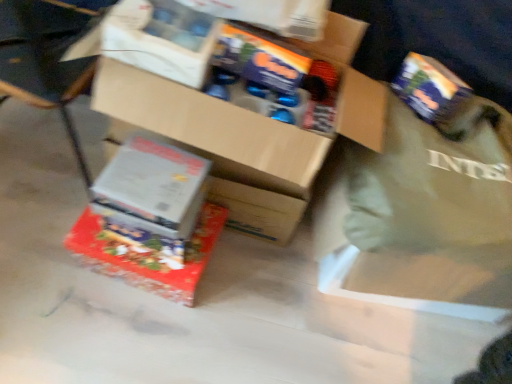
The image size is (512, 384). What are the coordinates of `cardboard box at center, the first box positioned from the top` in the screenshot? It's located at (219, 146).

This screenshot has width=512, height=384. What do you see at coordinates (152, 187) in the screenshot?
I see `white cardboard box at lower left, placed as the 2th box when sorted from bottom to top` at bounding box center [152, 187].

Describe the element at coordinates (433, 181) in the screenshot. I see `green fabric tote bag at right` at that location.

Image resolution: width=512 pixels, height=384 pixels. What are the coordinates of `shiny metallic box at center, placed as the 3th box when sorted from top to bottom` in the screenshot? It's located at (147, 255).

Identify the location of cardboard box at center, marked as the 3th box in a bottom-to-top arrangement. The height and width of the screenshot is (384, 512). [x=219, y=146].

Between cardboard box at center, marked as the 3th box in a bottom-to-top arrangement, and shiny metallic box at center, positioned as the first box in bottom-to-top order, which one is positioned behind?

shiny metallic box at center, positioned as the first box in bottom-to-top order, is more distant.

Can you confirm if cardboard box at center, marked as the 3th box in a bottom-to-top arrangement, is smaller than shiny metallic box at center, positioned as the first box in bottom-to-top order?

Actually, cardboard box at center, marked as the 3th box in a bottom-to-top arrangement, might be larger than shiny metallic box at center, positioned as the first box in bottom-to-top order.

Between point (316, 44) and point (214, 204), which one is positioned behind?

The point (214, 204) is farther from the camera.

What are the coordinates of `the 2nd box below the cardboard box at center, marked as the 3th box in a bottom-to-top arrangement (from a real-world perspective)` in the screenshot? It's located at (147, 255).

Considering the relative positions of cardboard box at center, the first box positioned from the top, and wooden chair at lower left in the image provided, is cardboard box at center, the first box positioned from the top, to the right of wooden chair at lower left from the viewer's perspective?

Yes.

Which object is wider, cardboard box at center, marked as the 3th box in a bottom-to-top arrangement, or wooden chair at lower left?

With larger width is wooden chair at lower left.

Is point (248, 229) positioned in front of point (52, 7)?

No.

Is cardboard box at center, marked as the 3th box in a bottom-to-top arrangement, in front of or behind wooden chair at lower left in the image?

cardboard box at center, marked as the 3th box in a bottom-to-top arrangement, is positioned farther from the viewer than wooden chair at lower left.

From the image's perspective, between wooden chair at lower left and white cardboard box at lower left, placed as the 2th box when sorted from bottom to top, who is located below?

white cardboard box at lower left, placed as the 2th box when sorted from bottom to top, appears lower in the image.

Which is more to the left, wooden chair at lower left or white cardboard box at lower left, placed as the 2th box when sorted from bottom to top?

From the viewer's perspective, wooden chair at lower left appears more on the left side.

Find the location of a particular element. chair that is above the white cardboard box at lower left, placed as the 2th box when sorted from bottom to top (from the image's perspective) is located at coordinates (44, 61).

From a real-world perspective, is wooden chair at lower left under white cardboard box at lower left, marked as the 2th box in a top-to-bottom arrangement?

Correct, in the physical world, wooden chair at lower left is lower than white cardboard box at lower left, marked as the 2th box in a top-to-bottom arrangement.

Is wooden chair at lower left facing away from green fabric tote bag at right?

No.

Is wooden chair at lower left completely or partially outside of green fabric tote bag at right?

Absolutely, wooden chair at lower left is external to green fabric tote bag at right.

Which object is positioned more to the right, wooden chair at lower left or green fabric tote bag at right?

green fabric tote bag at right is more to the right.

From a real-world perspective, which is physically above, wooden chair at lower left or green fabric tote bag at right?

In real-world perspective, green fabric tote bag at right is above.

Considering the relative sizes of green fabric tote bag at right and white cardboard box at lower left, marked as the 2th box in a top-to-bottom arrangement, in the image provided, is green fabric tote bag at right bigger than white cardboard box at lower left, marked as the 2th box in a top-to-bottom arrangement,?

Yes, green fabric tote bag at right is bigger than white cardboard box at lower left, marked as the 2th box in a top-to-bottom arrangement.

Is green fabric tote bag at right positioned beyond the bounds of white cardboard box at lower left, placed as the 2th box when sorted from bottom to top?

Indeed, green fabric tote bag at right is completely outside white cardboard box at lower left, placed as the 2th box when sorted from bottom to top.

From a real-world perspective, is green fabric tote bag at right over white cardboard box at lower left, marked as the 2th box in a top-to-bottom arrangement?

Correct, in the physical world, green fabric tote bag at right is higher than white cardboard box at lower left, marked as the 2th box in a top-to-bottom arrangement.

Is green fabric tote bag at right next to white cardboard box at lower left, marked as the 2th box in a top-to-bottom arrangement, and touching it?

No, green fabric tote bag at right is not making contact with white cardboard box at lower left, marked as the 2th box in a top-to-bottom arrangement.

From the image's perspective, which object appears higher, white cardboard box at lower left, placed as the 2th box when sorted from bottom to top, or green fabric tote bag at right?

white cardboard box at lower left, placed as the 2th box when sorted from bottom to top, from the image's perspective.

Is white cardboard box at lower left, placed as the 2th box when sorted from bottom to top, bigger or smaller than green fabric tote bag at right?

white cardboard box at lower left, placed as the 2th box when sorted from bottom to top, is smaller than green fabric tote bag at right.

Is white cardboard box at lower left, placed as the 2th box when sorted from bottom to top, not near green fabric tote bag at right?

They are positioned close to each other.

Between white cardboard box at lower left, placed as the 2th box when sorted from bottom to top, and green fabric tote bag at right, which one has less height?

Standing shorter between the two is white cardboard box at lower left, placed as the 2th box when sorted from bottom to top.

Considering the sizes of shiny metallic box at center, placed as the 3th box when sorted from top to bottom, and wooden chair at lower left in the image, is shiny metallic box at center, placed as the 3th box when sorted from top to bottom, taller or shorter than wooden chair at lower left?

Clearly, shiny metallic box at center, placed as the 3th box when sorted from top to bottom, is shorter compared to wooden chair at lower left.

Is shiny metallic box at center, placed as the 3th box when sorted from top to bottom, oriented towards wooden chair at lower left?

No, shiny metallic box at center, placed as the 3th box when sorted from top to bottom, is not turned towards wooden chair at lower left.

Between shiny metallic box at center, positioned as the first box in bottom-to-top order, and wooden chair at lower left, which one has larger width?

wooden chair at lower left.

From a real-world perspective, which box is the 2nd one above the shiny metallic box at center, placed as the 3th box when sorted from top to bottom? Please provide its 2D coordinates.

[(219, 146)]

The image size is (512, 384). I want to click on chair above the cardboard box at center, the first box positioned from the top (from the image's perspective), so click(x=44, y=61).

Which object lies further to the anchor point green fabric tote bag at right, wooden chair at lower left or cardboard box at center, marked as the 3th box in a bottom-to-top arrangement?

The object further to green fabric tote bag at right is wooden chair at lower left.

Based on the photo, when comparing their distances from white cardboard box at lower left, marked as the 2th box in a top-to-bottom arrangement, does wooden chair at lower left or green fabric tote bag at right seem closer?

wooden chair at lower left is closer to white cardboard box at lower left, marked as the 2th box in a top-to-bottom arrangement.

Estimate the real-world distances between objects in this image. Which object is closer to shiny metallic box at center, positioned as the first box in bottom-to-top order, white cardboard box at lower left, placed as the 2th box when sorted from bottom to top, or green fabric tote bag at right?

Based on the image, white cardboard box at lower left, placed as the 2th box when sorted from bottom to top, appears to be nearer to shiny metallic box at center, positioned as the first box in bottom-to-top order.

Considering their positions, is white cardboard box at lower left, placed as the 2th box when sorted from bottom to top, positioned further to shiny metallic box at center, positioned as the first box in bottom-to-top order, than wooden chair at lower left?

Based on the image, wooden chair at lower left appears to be further to shiny metallic box at center, positioned as the first box in bottom-to-top order.

Estimate the real-world distances between objects in this image. Which object is further from green fabric tote bag at right, white cardboard box at lower left, placed as the 2th box when sorted from bottom to top, or shiny metallic box at center, positioned as the first box in bottom-to-top order?

shiny metallic box at center, positioned as the first box in bottom-to-top order, lies further to green fabric tote bag at right than the other object.

Estimate the real-world distances between objects in this image. Which object is closer to wooden chair at lower left, shiny metallic box at center, placed as the 3th box when sorted from top to bottom, or green fabric tote bag at right?

shiny metallic box at center, placed as the 3th box when sorted from top to bottom, is positioned closer to the anchor wooden chair at lower left.

Considering their positions, is wooden chair at lower left positioned further to green fabric tote bag at right than white cardboard box at lower left, placed as the 2th box when sorted from bottom to top?

The object further to green fabric tote bag at right is wooden chair at lower left.

Consider the image. Looking at the image, which one is located further to shiny metallic box at center, positioned as the first box in bottom-to-top order, green fabric tote bag at right or wooden chair at lower left?

The object further to shiny metallic box at center, positioned as the first box in bottom-to-top order, is green fabric tote bag at right.

I want to click on box between cardboard box at center, marked as the 3th box in a bottom-to-top arrangement, and shiny metallic box at center, positioned as the first box in bottom-to-top order, in the up-down direction, so click(152, 187).

The width and height of the screenshot is (512, 384). In order to click on box between white cardboard box at lower left, placed as the 2th box when sorted from bottom to top, and green fabric tote bag at right in this screenshot , I will do `click(219, 146)`.